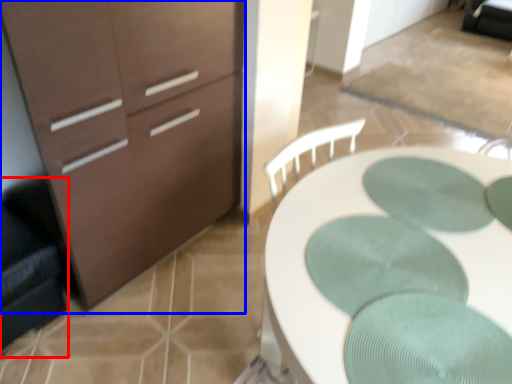
Question: Which of the following is the closest to the observer, swivel chair (highlighted by a red box) or chest of drawers (highlighted by a blue box)?

Choices:
 (A) swivel chair
 (B) chest of drawers

Answer: (B)